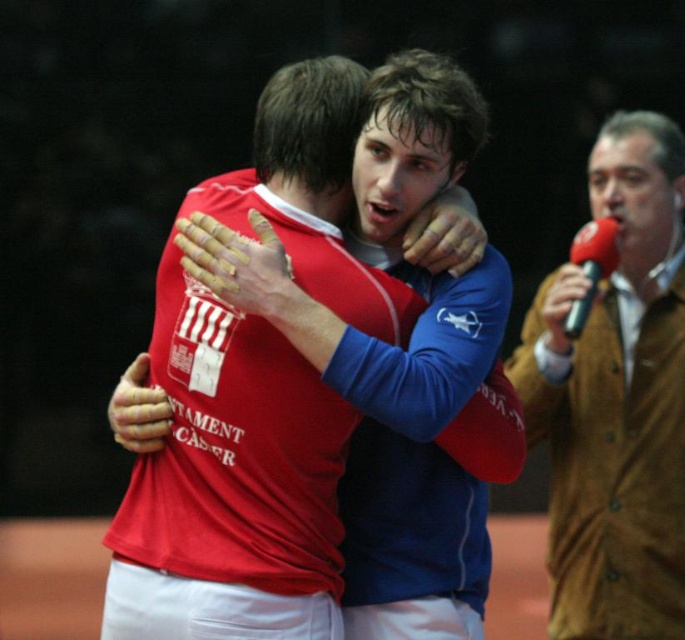
You are a photographer at the sports event. You need to capture a photo where both the matte red jersey at center and the black plastic microphone at right are visible. Based on their positions, which object should you focus on first to ensure both are in frame?

The matte red jersey at center is located below the black plastic microphone at right. To capture both in the frame, focus on the black plastic microphone at right first since it is higher up, allowing the jersey to naturally fall into the lower part of the shot.

You are a photographer at the sports event and need to capture a photo where both the matte red jersey at center and the black plastic microphone at right are visible. Based on their positions, which object should you focus on first to ensure both are in frame?

The matte red jersey at center is positioned on the left side of the black plastic microphone at right. To ensure both are in frame, focus on the matte red jersey at center first since it is closer to the left edge, allowing the microphone to naturally fall into the right side of the frame.